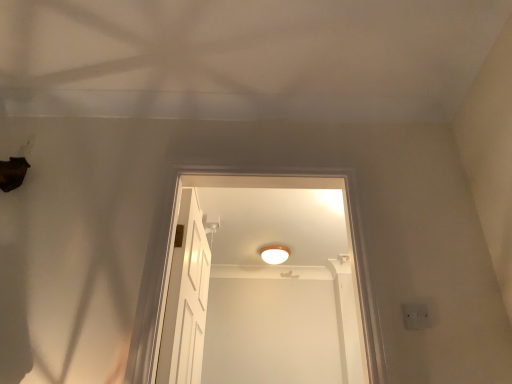
What do you see at coordinates (274, 254) in the screenshot? I see `white matte light fixture at center` at bounding box center [274, 254].

Where is `white matte light fixture at center`? The image size is (512, 384). white matte light fixture at center is located at coordinates (274, 254).

Image resolution: width=512 pixels, height=384 pixels. Describe the element at coordinates (186, 297) in the screenshot. I see `white wooden door at center` at that location.

Measure the distance between white wooden door at center and camera.

white wooden door at center is 1.41 meters from camera.

What are the coordinates of `white wooden door at center` in the screenshot? It's located at (186, 297).

At what (x,y) coordinates should I click in order to perform the action: click on white matte light fixture at center. Please return your answer as a coordinate pair (x, y). Image resolution: width=512 pixels, height=384 pixels. Looking at the image, I should click on (274, 254).

Considering the positions of objects white wooden door at center and white matte light fixture at center in the image provided, who is more to the left, white wooden door at center or white matte light fixture at center?

white wooden door at center.

Is white wooden door at center positioned behind white matte light fixture at center?

No, it is in front of white matte light fixture at center.

Which is in front, point (169, 308) or point (267, 258)?

The point (169, 308) is closer to the camera.

From the image's perspective, which one is positioned lower, white wooden door at center or white matte light fixture at center?

white wooden door at center.

From a real-world perspective, is white wooden door at center over white matte light fixture at center?

No, from a real-world perspective, white wooden door at center is not over white matte light fixture at center

Which of these two, white wooden door at center or white matte light fixture at center, is wider?

With larger width is white matte light fixture at center.

Considering the sizes of objects white wooden door at center and white matte light fixture at center in the image provided, who is shorter, white wooden door at center or white matte light fixture at center?

white matte light fixture at center.

Based on the photo, who is smaller, white wooden door at center or white matte light fixture at center?

white matte light fixture at center.

Is white wooden door at center outside of white matte light fixture at center?

Indeed, white wooden door at center is completely outside white matte light fixture at center.

Are white wooden door at center and white matte light fixture at center far apart?

Yes, white wooden door at center and white matte light fixture at center are quite far apart.

Is white wooden door at center oriented towards white matte light fixture at center?

No.

How different are the orientations of white wooden door at center and white matte light fixture at center in degrees?

89 degrees.

Measure the distance between white wooden door at center and white matte light fixture at center.

white wooden door at center is 1.17 meters from white matte light fixture at center.

You are a GUI agent. You are given a task and a screenshot of the screen. Output one action in this format:
    pyautogui.click(x=<x>, y=<y>)
    Task: Click on the door on the left of the white matte light fixture at center
    
    Given the screenshot: What is the action you would take?
    pyautogui.click(x=186, y=297)

Considering the relative positions of white matte light fixture at center and white wooden door at center in the image provided, is white matte light fixture at center to the left of white wooden door at center from the viewer's perspective?

No.

Which object is further away from the camera taking this photo, white matte light fixture at center or white wooden door at center?

Positioned behind is white matte light fixture at center.

Does point (288, 249) come farther from viewer compared to point (192, 254)?

Yes.

From the image's perspective, would you say white matte light fixture at center is shown under white wooden door at center?

Actually, white matte light fixture at center appears above white wooden door at center in the image.

From a real-world perspective, which is physically above, white matte light fixture at center or white wooden door at center?

white matte light fixture at center.

Considering the relative sizes of white matte light fixture at center and white wooden door at center in the image provided, is white matte light fixture at center thinner than white wooden door at center?

Incorrect, the width of white matte light fixture at center is not less than that of white wooden door at center.

Which of these two, white matte light fixture at center or white wooden door at center, stands shorter?

With less height is white matte light fixture at center.

Between white matte light fixture at center and white wooden door at center, which one has smaller size?

white matte light fixture at center.

Can we say white matte light fixture at center lies outside white wooden door at center?

Indeed, white matte light fixture at center is completely outside white wooden door at center.

Is white matte light fixture at center placed right next to white wooden door at center?

No, white matte light fixture at center is not making contact with white wooden door at center.

Is white matte light fixture at center turned away from white wooden door at center?

white matte light fixture at center is not turned away from white wooden door at center.

How many degrees apart are the facing directions of white matte light fixture at center and white wooden door at center?

white matte light fixture at center and white wooden door at center are facing 89 degrees away from each other.

Where is `door that appears in front of the white matte light fixture at center`? door that appears in front of the white matte light fixture at center is located at coordinates (186, 297).

At what (x,y) coordinates should I click in order to perform the action: click on light fixture above the white wooden door at center (from the image's perspective). Please return your answer as a coordinate pair (x, y). The image size is (512, 384). Looking at the image, I should click on (274, 254).

At what (x,y) coordinates should I click in order to perform the action: click on light fixture that appears on the right of white wooden door at center. Please return your answer as a coordinate pair (x, y). The image size is (512, 384). Looking at the image, I should click on (274, 254).